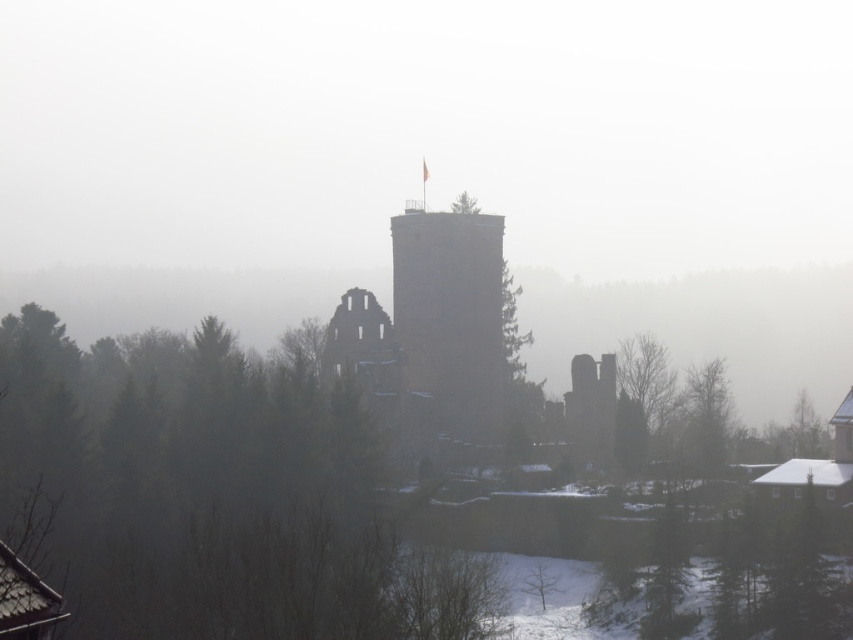
Does point (405, 230) come farther from viewer compared to point (717, 433)?

Yes, point (405, 230) is farther from viewer.

Does point (454, 252) lie in front of point (705, 461)?

No, (454, 252) is further to viewer.

In order to click on brown stone tower at center in this screenshot , I will do `click(451, 317)`.